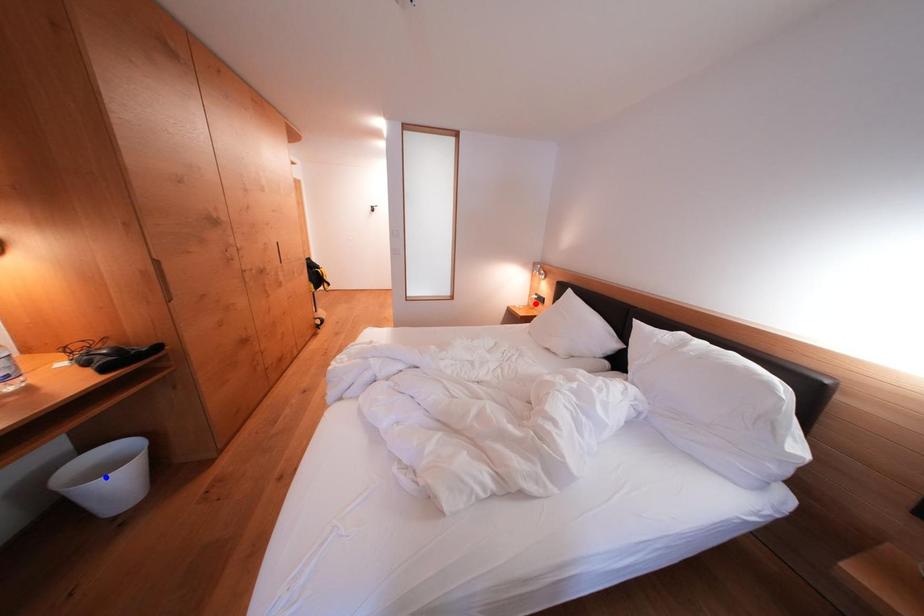
Question: Two points are marked on the image. Which point is closer to the camera?

Choices:
 (A) Blue point is closer.
 (B) Red point is closer.

Answer: (A)